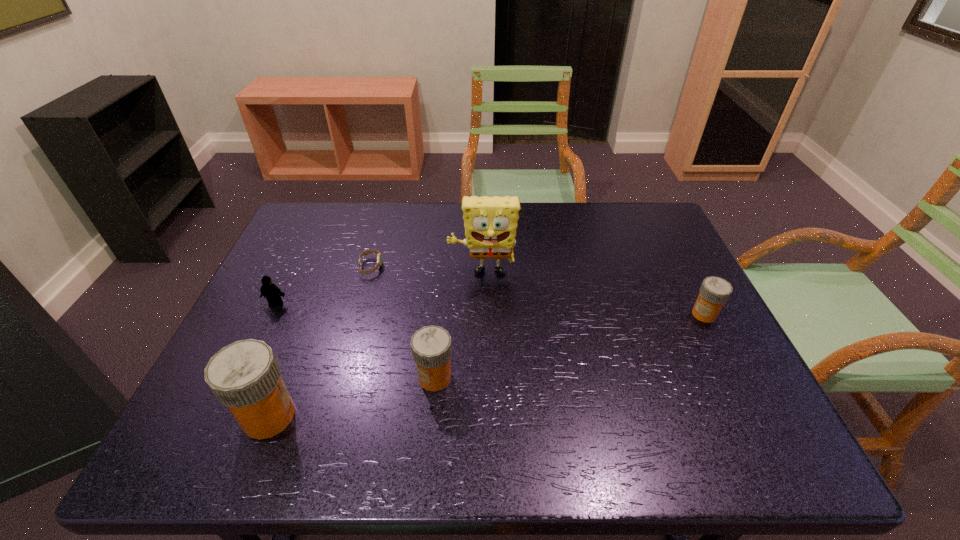
Where is `medicine at the left edge`? medicine at the left edge is located at coordinates (245, 376).

In order to click on Lego present at the left edge in this screenshot , I will do `click(273, 294)`.

Where is `object present at the right edge`? The image size is (960, 540). object present at the right edge is located at coordinates (714, 292).

This screenshot has height=540, width=960. In order to click on object that is at the near left corner in this screenshot , I will do `click(245, 376)`.

Locate an element on the screen. The width and height of the screenshot is (960, 540). free space at the far edge is located at coordinates pos(611,219).

Where is `vacant space at the near edge of the desktop`? vacant space at the near edge of the desktop is located at coordinates (576, 383).

Locate an element on the screen. This screenshot has height=540, width=960. free space at the left edge is located at coordinates (307, 292).

This screenshot has width=960, height=540. Find the location of `free space at the right edge`. free space at the right edge is located at coordinates (697, 281).

The width and height of the screenshot is (960, 540). Identify the location of blank space at the far left corner of the desktop. (292, 235).

I want to click on vacant point at the far right corner, so click(649, 245).